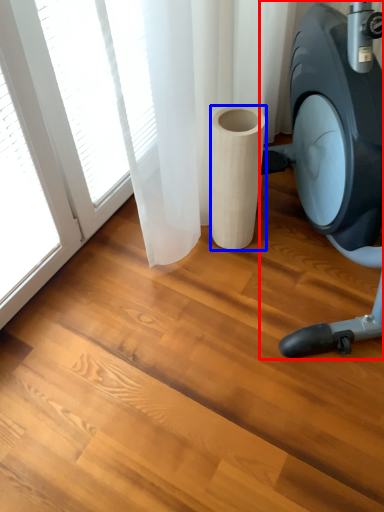
Question: Among these objects, which one is farthest to the camera, stationary bicycle (highlighted by a red box) or paper towel (highlighted by a blue box)?

Choices:
 (A) stationary bicycle
 (B) paper towel

Answer: (B)